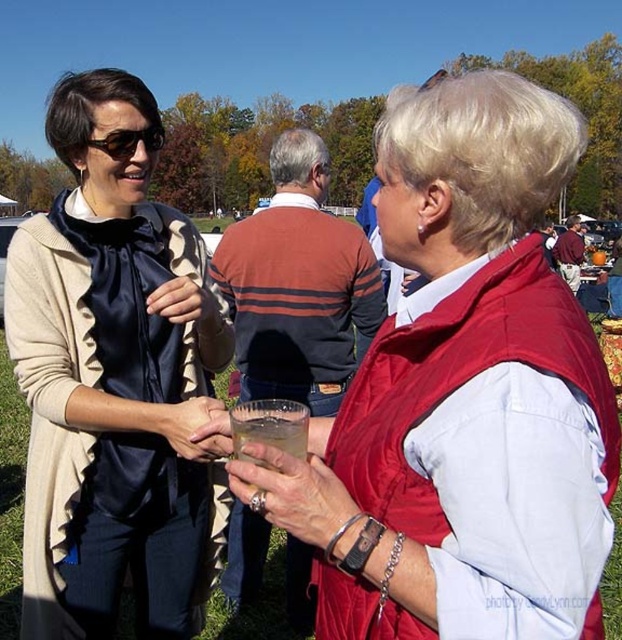
Is point (486, 577) farther from camera compared to point (100, 253)?

That is False.

Which of these two, matte red vest at center or matte black blouse at center, stands taller?

matte black blouse at center is taller.

Is point (453, 346) farther from viewer compared to point (156, 106)?

No, it is not.

At what (x,y) coordinates should I click in order to perform the action: click on matte red vest at center. Please return your answer as a coordinate pair (x, y). Image resolution: width=622 pixels, height=640 pixels. Looking at the image, I should click on (462, 396).

Does matte red vest at center have a greater width compared to matte black sunglasses at upper left?

Yes.

Does matte red vest at center appear on the right side of matte black sunglasses at upper left?

Result: Yes, matte red vest at center is to the right of matte black sunglasses at upper left.

Does point (401, 621) come farther from viewer compared to point (128, 132)?

No, (401, 621) is in front of (128, 132).

Image resolution: width=622 pixels, height=640 pixels. I want to click on matte red vest at center, so click(x=462, y=396).

Is matte black blouse at center to the left of matte black sunglasses at upper left from the viewer's perspective?

Indeed, matte black blouse at center is positioned on the left side of matte black sunglasses at upper left.

Is point (101, 132) closer to viewer compared to point (151, 134)?

Yes, it is in front of point (151, 134).

This screenshot has height=640, width=622. What are the coordinates of `matte black blouse at center` in the screenshot? It's located at (113, 380).